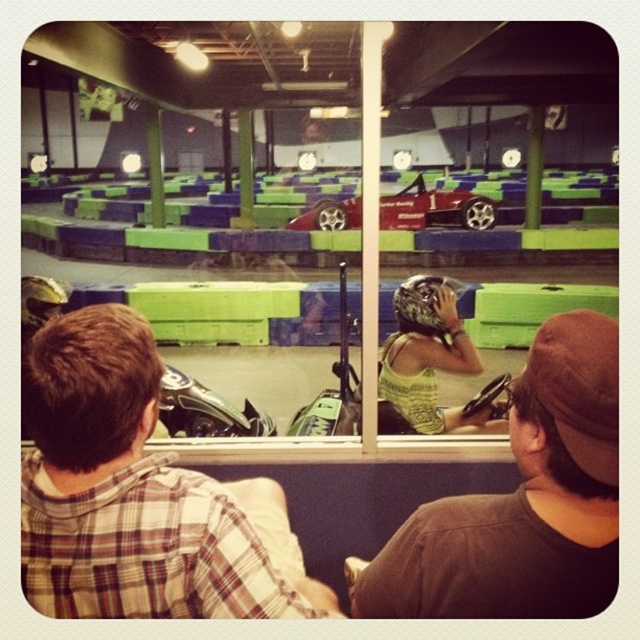
Question: Which object is the closest to the shiny red car at center?

Choices:
 (A) green tank top at center
 (B) green patterned tank top at center

Answer: (B)

Question: Which point is farther to the camera?

Choices:
 (A) plaid shirt at center
 (B) green tank top at center
 (C) shiny red car at center

Answer: (C)

Question: Which object appears closest to the camera in this image?

Choices:
 (A) transparent glass window at center
 (B) green patterned tank top at center
 (C) shiny red car at center

Answer: (A)

Question: Is the position of green tank top at center less distant than that of green patterned tank top at center?

Choices:
 (A) yes
 (B) no

Answer: (A)

Question: Is green tank top at center closer to camera compared to green patterned tank top at center?

Choices:
 (A) yes
 (B) no

Answer: (A)

Question: Does plaid shirt at center come in front of green patterned tank top at center?

Choices:
 (A) no
 (B) yes

Answer: (B)